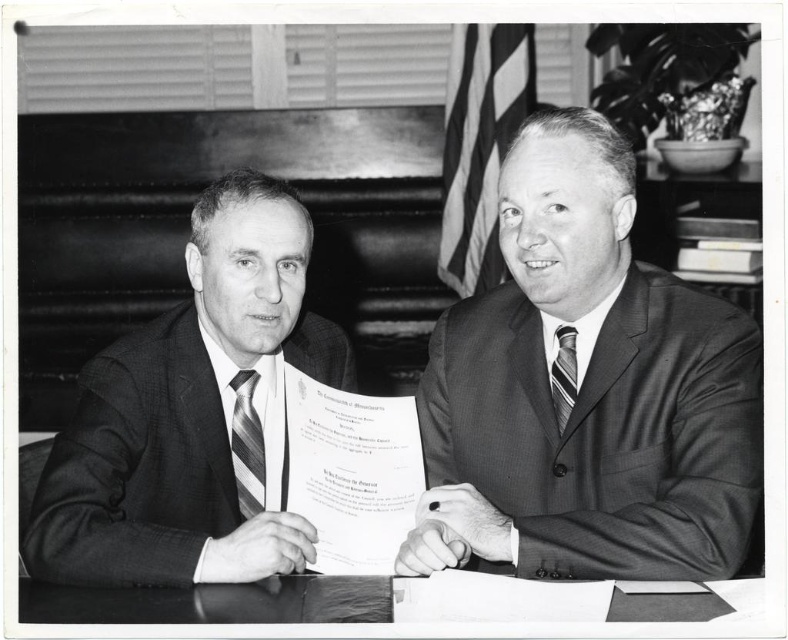
Is point (563, 316) closer to camera compared to point (235, 420)?

Yes, point (563, 316) is closer to viewer.

Looking at this image, can you confirm if smooth suit at center is positioned to the right of striped silk tie at left?

Yes, smooth suit at center is to the right of striped silk tie at left.

The width and height of the screenshot is (788, 640). Describe the element at coordinates (586, 390) in the screenshot. I see `smooth suit at center` at that location.

The height and width of the screenshot is (640, 788). What are the coordinates of `smooth suit at center` in the screenshot? It's located at [x=586, y=390].

Who is more distant from viewer, (243,500) or (575,374)?

Point (243,500)

Is striped silk tie at left positioned before striped fabric tie at center?

No, striped silk tie at left is behind striped fabric tie at center.

What do you see at coordinates (247, 445) in the screenshot? I see `striped silk tie at left` at bounding box center [247, 445].

At what (x,y) coordinates should I click in order to perform the action: click on striped silk tie at left. Please return your answer as a coordinate pair (x, y). The image size is (788, 640). Looking at the image, I should click on (247, 445).

From the picture: Who is higher up, smooth suit at center or smooth paper document at center?

smooth suit at center is above.

From the picture: Can you confirm if smooth suit at center is wider than smooth paper document at center?

Yes, smooth suit at center is wider than smooth paper document at center.

At what (x,y) coordinates should I click in order to perform the action: click on smooth suit at center. Please return your answer as a coordinate pair (x, y). The image size is (788, 640). Looking at the image, I should click on (586, 390).